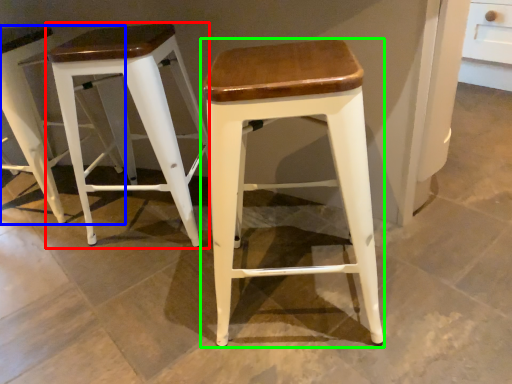
Question: Which object is the closest to the stool (highlighted by a red box)? Choose among these: stool (highlighted by a blue box) or stool (highlighted by a green box).

Choices:
 (A) stool
 (B) stool

Answer: (A)